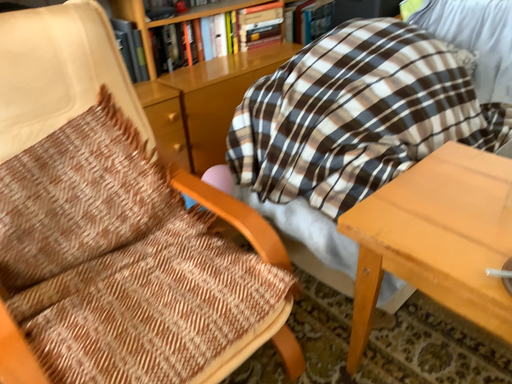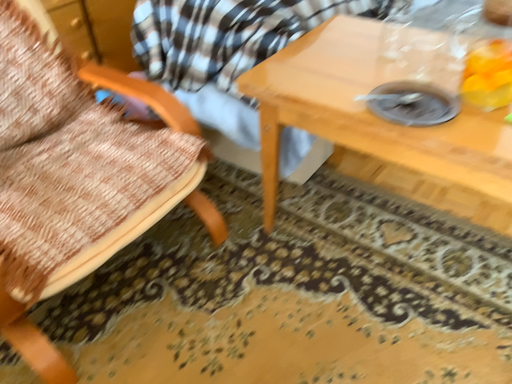
Question: How did the camera likely rotate when shooting the video?

Choices:
 (A) rotated upward
 (B) rotated downward

Answer: (B)